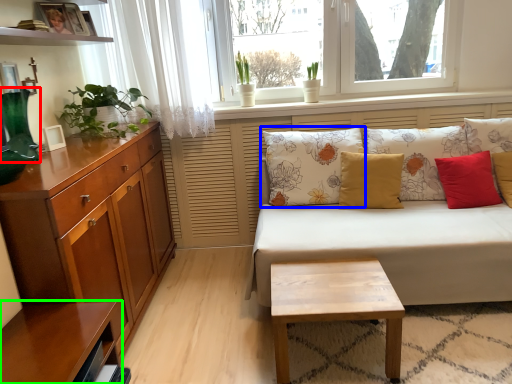
Question: Which object is the farthest from vase (highlighted by a red box)? Choose among these: pillow (highlighted by a blue box) or shelf (highlighted by a green box).

Choices:
 (A) pillow
 (B) shelf

Answer: (A)